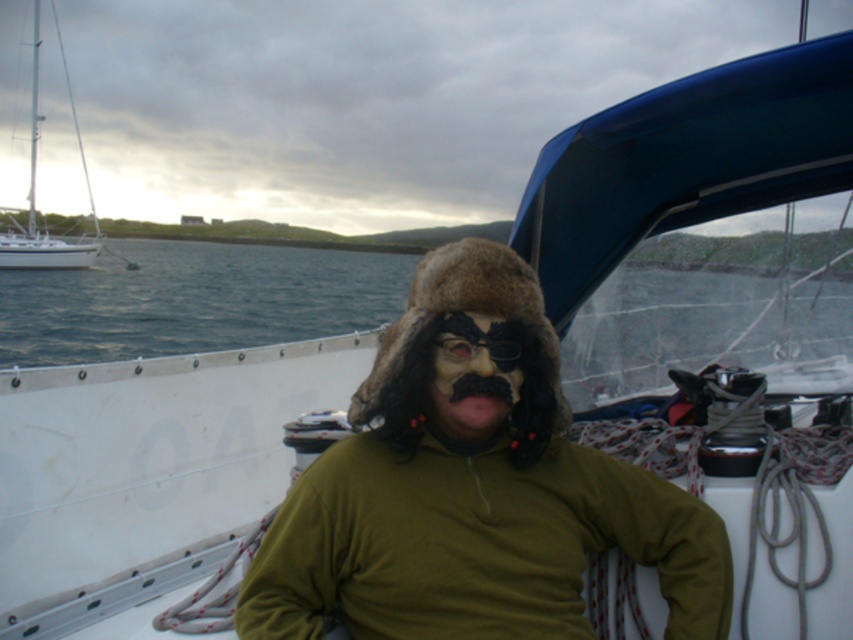
Does brown fur hat at center have a lesser width compared to blue water at left?

Yes, brown fur hat at center is thinner than blue water at left.

Does brown fur hat at center have a greater width compared to blue water at left?

No.

Does point (375, 483) lie behind point (64, 328)?

No.

Locate an element on the screen. brown fur hat at center is located at coordinates (473, 493).

Based on the photo, does fuzzy brown fur hat at center appear on the right side of white glossy sailboat at left?

Indeed, fuzzy brown fur hat at center is positioned on the right side of white glossy sailboat at left.

Can you confirm if fuzzy brown fur hat at center is bigger than white glossy sailboat at left?

Actually, fuzzy brown fur hat at center might be smaller than white glossy sailboat at left.

At what (x,y) coordinates should I click in order to perform the action: click on fuzzy brown fur hat at center. Please return your answer as a coordinate pair (x, y). The image size is (853, 640). Looking at the image, I should click on (x=473, y=376).

Describe the element at coordinates (193, 300) in the screenshot. This screenshot has width=853, height=640. I see `blue water at left` at that location.

Is blue water at left to the right of fuzzy brown fur hat at center from the viewer's perspective?

Incorrect, blue water at left is not on the right side of fuzzy brown fur hat at center.

Does point (16, 292) come in front of point (476, 378)?

No, it is behind (476, 378).

The width and height of the screenshot is (853, 640). Find the location of `blue water at left`. blue water at left is located at coordinates (193, 300).